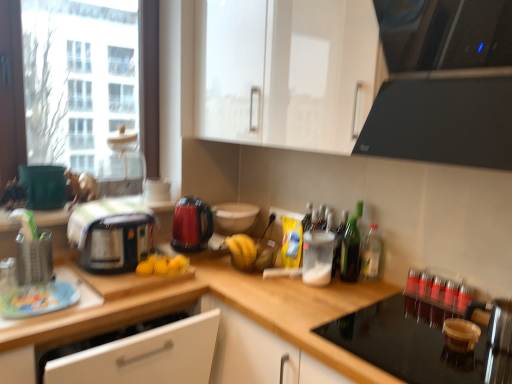
This screenshot has height=384, width=512. What are the coordinates of `vacant point above wooden at center, acting as the first countertop starting from the right (from a real-world perspective)` in the screenshot? It's located at (339, 311).